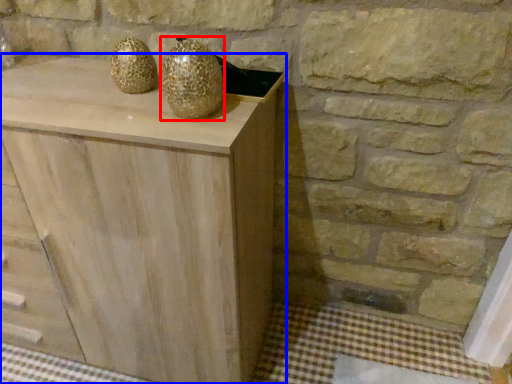
Question: Which object appears farthest to the camera in this image, glass vase (highlighted by a red box) or chest of drawers (highlighted by a blue box)?

Choices:
 (A) glass vase
 (B) chest of drawers

Answer: (A)